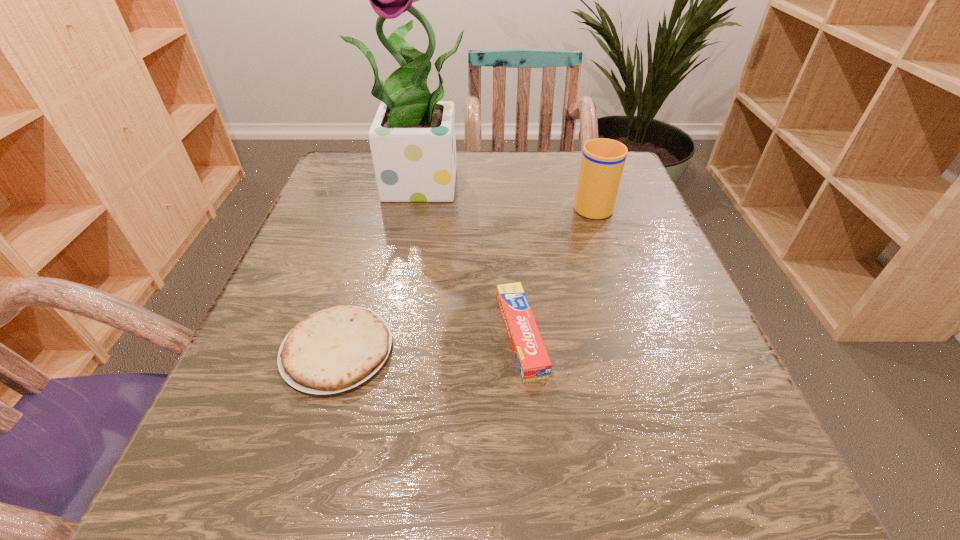
Find the location of a particular element. The image size is (960, 540). blank space that satisfies the following two spatial constraints: 1. on the front-facing side of the tallest object; 2. on the right side of the third tallest object is located at coordinates (403, 335).